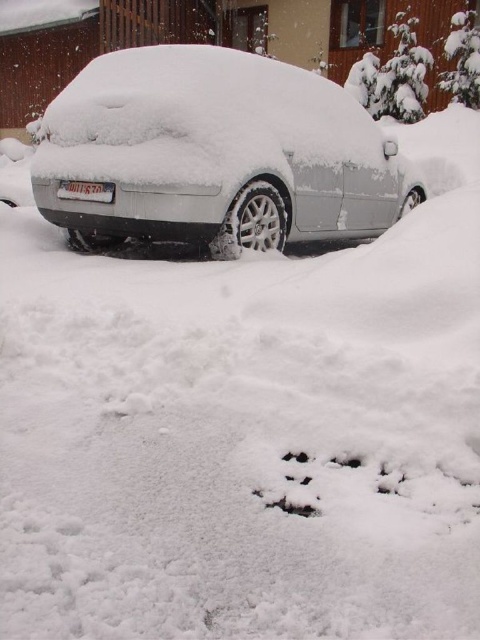
Question: Does white matte car at center lie in front of white plastic license plate at center?

Choices:
 (A) no
 (B) yes

Answer: (B)

Question: Does white matte car at center have a lesser width compared to white plastic license plate at center?

Choices:
 (A) yes
 (B) no

Answer: (B)

Question: Is white matte car at center wider than white plastic license plate at center?

Choices:
 (A) no
 (B) yes

Answer: (B)

Question: Which point appears farthest from the camera in this image?

Choices:
 (A) (111, 132)
 (B) (87, 188)

Answer: (B)

Question: Which point is farther to the camera?

Choices:
 (A) (72, 193)
 (B) (82, 148)

Answer: (A)